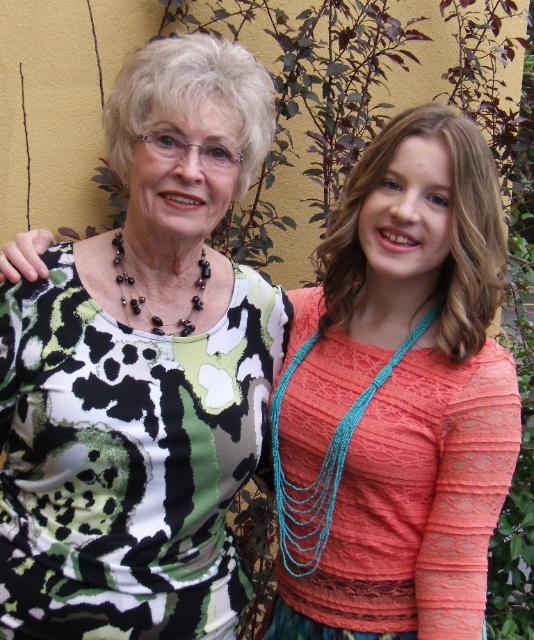
Who is more forward, (423,545) or (177,612)?

Positioned in front is point (177,612).

Measure the distance between coral lace top at center and printed fabric dress at center.

12.01 inches

This screenshot has height=640, width=534. What do you see at coordinates (396, 397) in the screenshot?
I see `coral lace top at center` at bounding box center [396, 397].

Identify the location of coral lace top at center. The width and height of the screenshot is (534, 640). (396, 397).